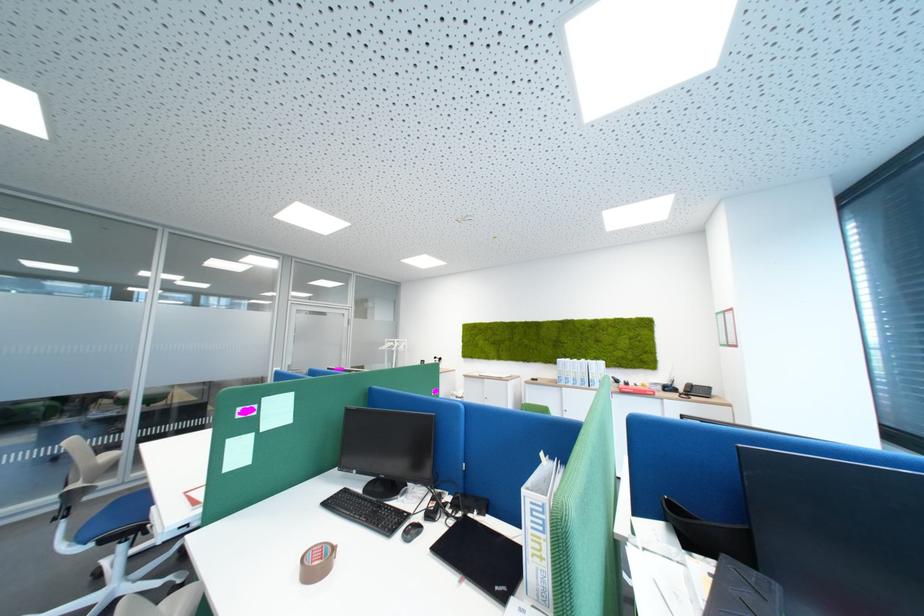
Find the location of a particular element. white cabinet handle is located at coordinates (505, 422).